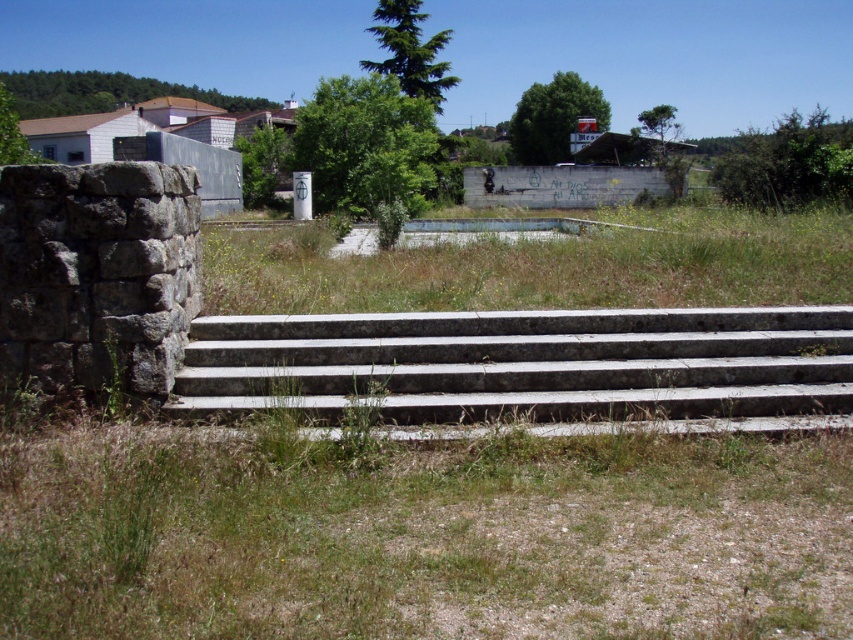
Does gray concrete stairs at center have a greater width compared to green grass at center?

No, gray concrete stairs at center is not wider than green grass at center.

Can you confirm if gray concrete stairs at center is positioned below green grass at center?

Yes, gray concrete stairs at center is below green grass at center.

Image resolution: width=853 pixels, height=640 pixels. Describe the element at coordinates (532, 368) in the screenshot. I see `gray concrete stairs at center` at that location.

You are a GUI agent. You are given a task and a screenshot of the screen. Output one action in this format:
    pyautogui.click(x=<x>, y=<y>)
    Task: Click on the gray concrete stairs at center
    
    Given the screenshot: What is the action you would take?
    pyautogui.click(x=532, y=368)